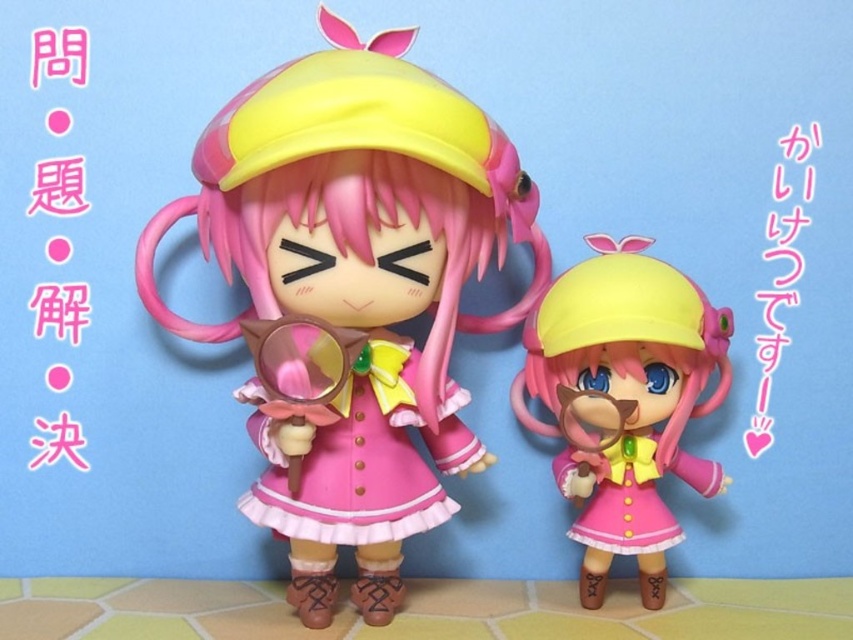
Question: Is matte pink dress at center thinner than pink satin dress at center?

Choices:
 (A) yes
 (B) no

Answer: (B)

Question: Among these points, which one is farthest from the camera?

Choices:
 (A) (619, 452)
 (B) (288, 413)

Answer: (A)

Question: Considering the real-world distances, which object is farthest from the pink satin dress at center?

Choices:
 (A) matte pink dress at center
 (B) pink satin dress at lower right

Answer: (B)

Question: Where is matte pink plastic toy at center located in relation to pink satin dress at lower right in the image?

Choices:
 (A) above
 (B) below

Answer: (A)

Question: Which point is farther from the camera taking this photo?

Choices:
 (A) (432, 364)
 (B) (643, 483)
 (C) (608, 486)

Answer: (C)

Question: Is matte pink plastic toy at center positioned at the back of pink satin dress at lower right?

Choices:
 (A) yes
 (B) no

Answer: (B)